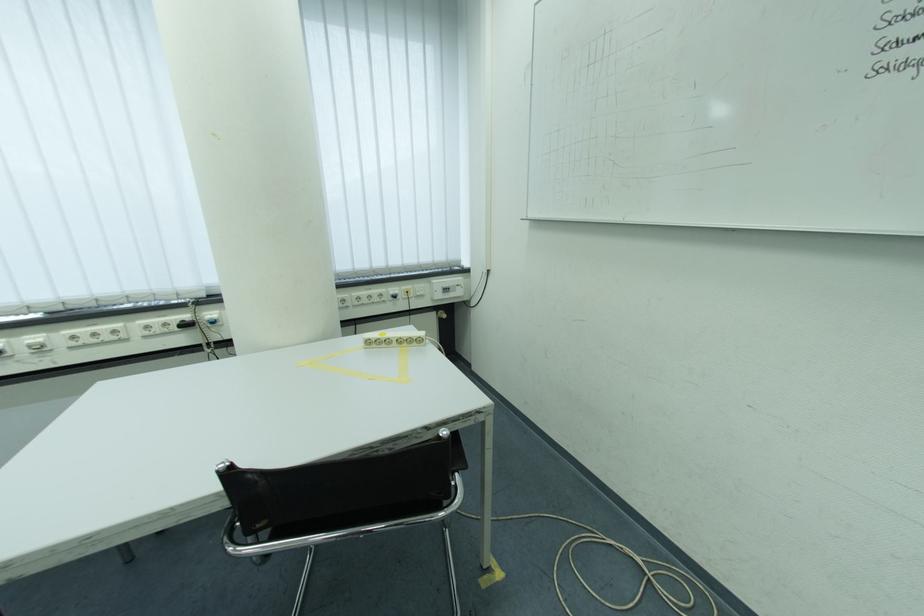
Locate an element on the screen. blue network port is located at coordinates (213, 321).